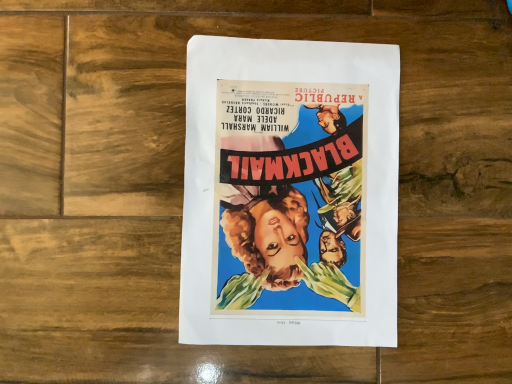
Question: Should I look upward or downward to see matte paper poster at center?

Choices:
 (A) up
 (B) down

Answer: (A)